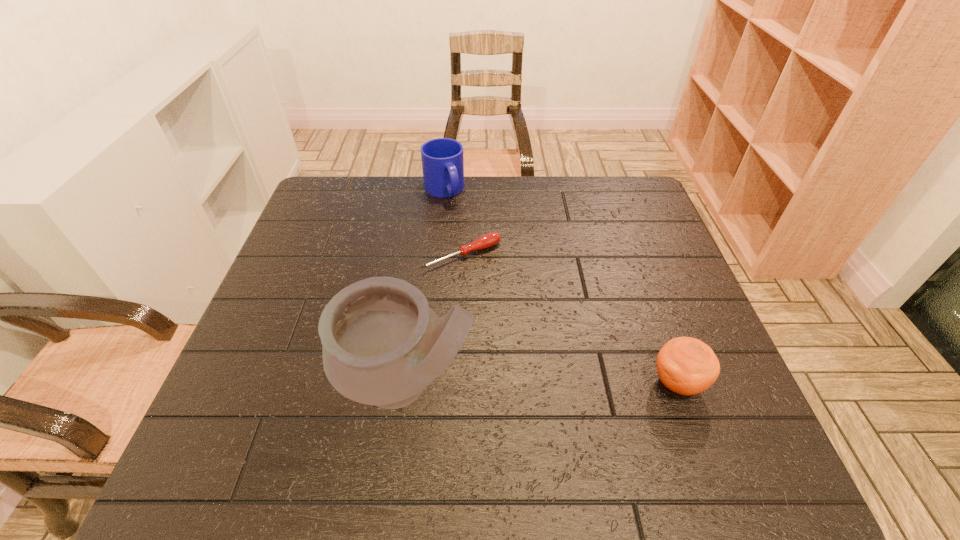
The image size is (960, 540). I want to click on vacant position at the left edge of the desktop, so click(320, 338).

Locate an element on the screen. This screenshot has width=960, height=540. free region at the right edge of the desktop is located at coordinates (611, 236).

This screenshot has height=540, width=960. I want to click on free space at the far left corner of the desktop, so click(x=316, y=215).

In the image, there is a desktop. Where is `free region at the near left corner`? The width and height of the screenshot is (960, 540). free region at the near left corner is located at coordinates (300, 387).

The width and height of the screenshot is (960, 540). Find the location of `free space between the pottery and the orange`. free space between the pottery and the orange is located at coordinates (542, 383).

Find the location of a particular element. This screenshot has width=960, height=540. free spot between the screwdriver and the farthest object is located at coordinates (453, 223).

Where is `free space between the orange and the third nearest object`? Image resolution: width=960 pixels, height=540 pixels. free space between the orange and the third nearest object is located at coordinates (569, 319).

At what (x,y) coordinates should I click in order to perform the action: click on empty space that is in between the mug and the pottery. Please return your answer as a coordinate pair (x, y). Looking at the image, I should click on (425, 287).

Identify the location of free spot between the farthest object and the orange. The image size is (960, 540). (561, 286).

Locate an element on the screen. free space between the shortest object and the farthest object is located at coordinates (453, 223).